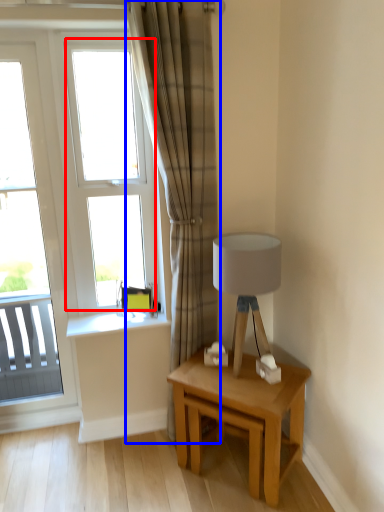
Question: Which object is closer to the camera taking this photo, window (highlighted by a red box) or curtain (highlighted by a blue box)?

Choices:
 (A) window
 (B) curtain

Answer: (B)